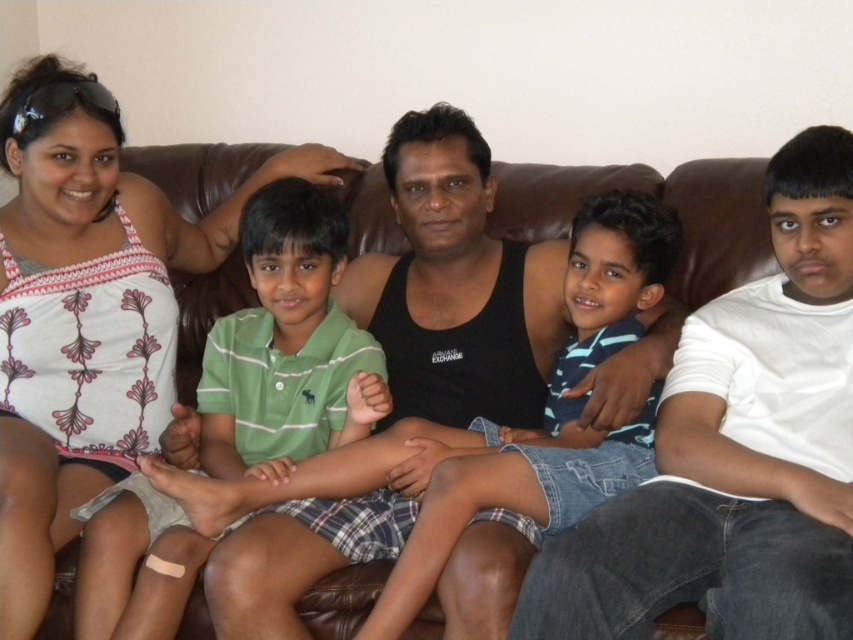
Question: Among these points, which one is nearest to the camera?

Choices:
 (A) (523, 515)
 (B) (811, 560)

Answer: (B)

Question: Is blue denim shorts at center positioned before white printed tank top at upper left?

Choices:
 (A) yes
 (B) no

Answer: (A)

Question: Is blue denim shorts at center thinner than white printed tank top at upper left?

Choices:
 (A) no
 (B) yes

Answer: (B)

Question: Which object is positioned closest to the white printed tank top at upper left?

Choices:
 (A) blue denim shorts at center
 (B) striped cotton shirt at center

Answer: (B)

Question: Is blue denim shorts at center above white printed tank top at upper left?

Choices:
 (A) yes
 (B) no

Answer: (B)

Question: Estimate the real-world distances between objects in this image. Which object is farther from the blue denim shorts at center?

Choices:
 (A) white printed tank top at upper left
 (B) striped cotton shirt at center

Answer: (A)